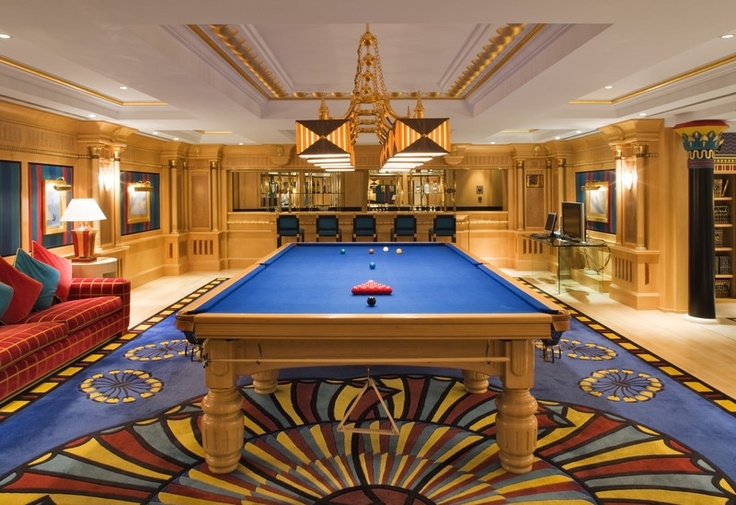
The width and height of the screenshot is (736, 505). In order to click on blue barstools in this screenshot , I will do `click(286, 228)`, `click(336, 225)`, `click(363, 221)`, `click(399, 222)`, `click(439, 223)`.